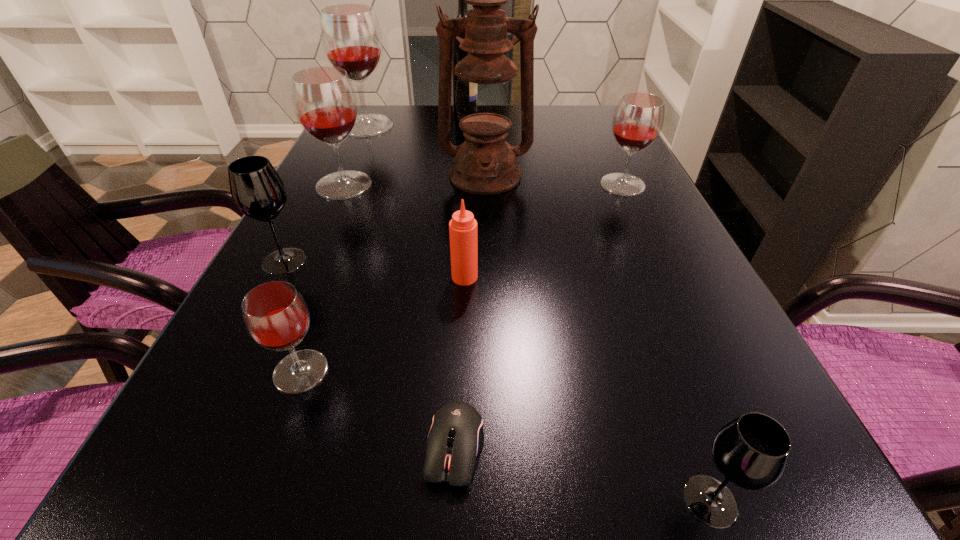
Find the location of a particular element. The width and height of the screenshot is (960, 540). free area in between the black computer mouse and the oil lamp is located at coordinates (470, 312).

This screenshot has height=540, width=960. Find the location of `free space between the black wine bottle and the nearest wineglass`. free space between the black wine bottle and the nearest wineglass is located at coordinates (588, 306).

The width and height of the screenshot is (960, 540). What are the coordinates of `unoccupied position between the Tabasco sauce and the third tallest object` in the screenshot? It's located at (416, 201).

You are a GUI agent. You are given a task and a screenshot of the screen. Output one action in this format:
    pyautogui.click(x=<x>, y=<y>)
    Task: Click on the vacant area that lies between the wine bottle and the fourth farthest wineglass
    Image resolution: width=960 pixels, height=540 pixels.
    Given the screenshot: What is the action you would take?
    pyautogui.click(x=374, y=186)

Locate an element on the screen. empty space between the left gray wineglass and the smaller gray wineglass is located at coordinates (497, 381).

The width and height of the screenshot is (960, 540). Identify the location of free point between the shortest object and the oil lamp. (470, 312).

Locate an element on the screen. This screenshot has width=960, height=540. free space that is in between the shortest object and the bigger gray wineglass is located at coordinates (370, 354).

Identify the location of object that is the second closest to the nearest red wineglass. (257, 190).

Identify the location of object that is the second closest to the Tabasco sauce. The width and height of the screenshot is (960, 540). (455, 438).

Where is `wineglass that is the fifth closest one to the Tabasco sauce`? The image size is (960, 540). wineglass that is the fifth closest one to the Tabasco sauce is located at coordinates 752,451.